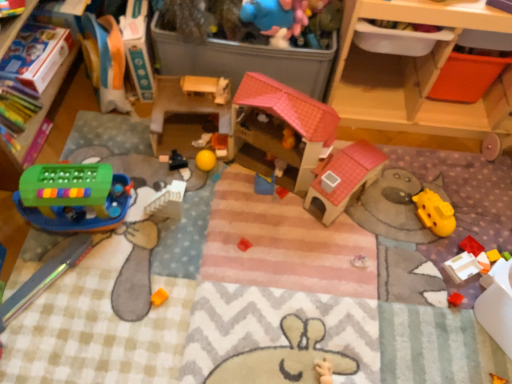
Locate an element on the screen. The width and height of the screenshot is (512, 384). vacant area to the left of white matte figurine at center, arranged as the sixth toy when viewed from the right is located at coordinates (150, 143).